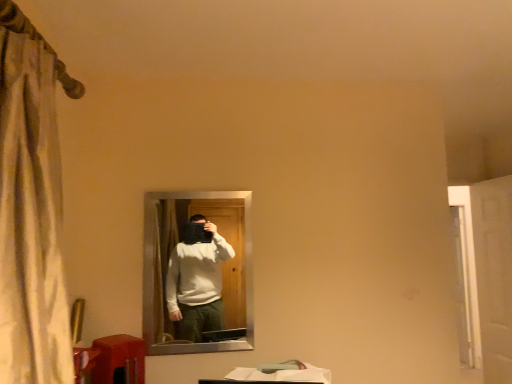
Question: Is matte black mirror at center inside the boundaries of matte orange table at lower left, or outside?

Choices:
 (A) inside
 (B) outside

Answer: (B)

Question: Considering the positions of point (245, 215) and point (137, 345), is point (245, 215) closer or farther from the camera than point (137, 345)?

Choices:
 (A) closer
 (B) farther

Answer: (B)

Question: Which is nearer to the white glossy door at right?

Choices:
 (A) matte black mirror at center
 (B) matte orange table at lower left

Answer: (A)

Question: Estimate the real-world distances between objects in this image. Which object is closer to the white glossy door at right?

Choices:
 (A) matte orange table at lower left
 (B) matte black mirror at center

Answer: (B)